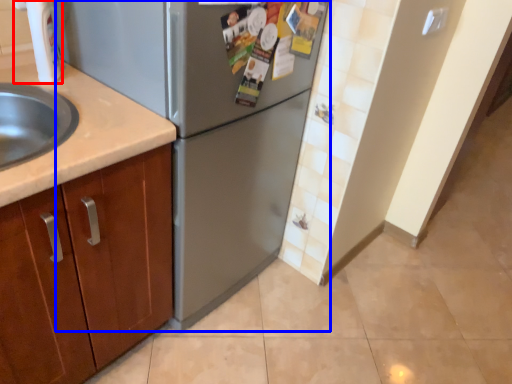
Question: Which point is closer to the camera, faucet (highlighted by a red box) or refrigerator (highlighted by a blue box)?

Choices:
 (A) faucet
 (B) refrigerator

Answer: (B)